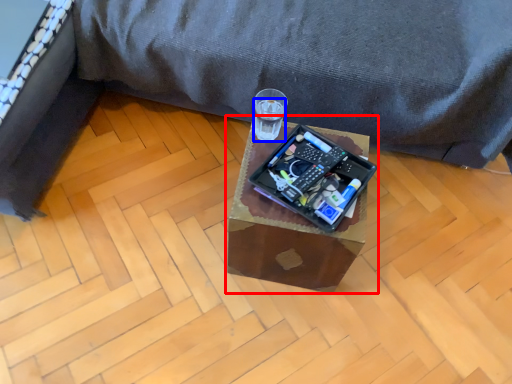
Question: Which object appears farthest to the camera in this image, table (highlighted by a red box) or beverage (highlighted by a blue box)?

Choices:
 (A) table
 (B) beverage

Answer: (B)